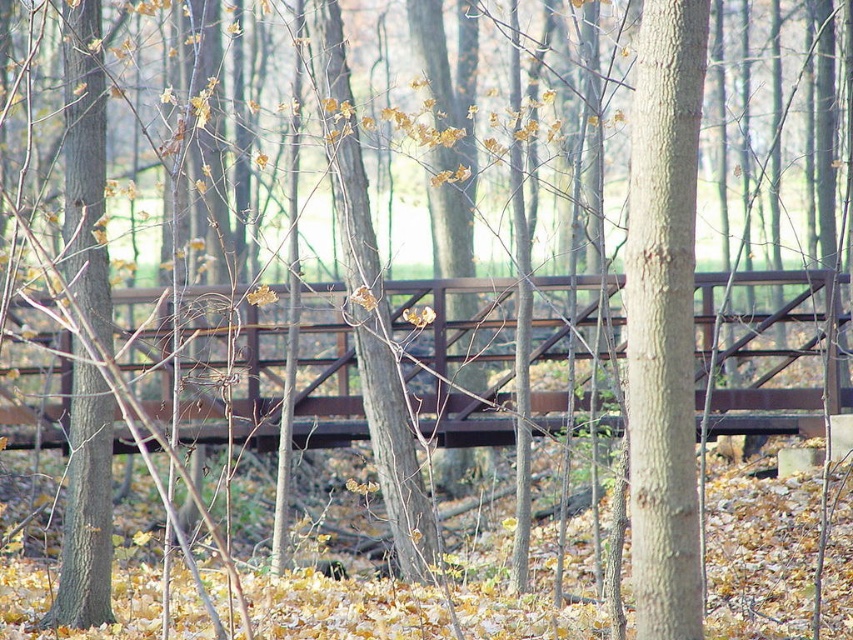
You are a hiker walking along a forest path and you see the smooth gray bark at center and the smooth brown tree trunk at left. Which one is closer to you?

The smooth gray bark at center is closer to you because it is in front of the smooth brown tree trunk at left.

You are a hiker trying to cross the brown metal bridge at center. There is a smooth gray bark at center nearby. Which object is wider?

The brown metal bridge at center is wider than the smooth gray bark at center according to the description.

You are a hiker who wants to cross the brown metal bridge at center but notices the smooth brown tree trunk at left above it. Is there enough space to walk under the tree trunk while crossing the bridge?

The brown metal bridge at center is positioned under the smooth brown tree trunk at left, so there may not be enough vertical clearance to walk under the tree trunk while crossing the bridge.